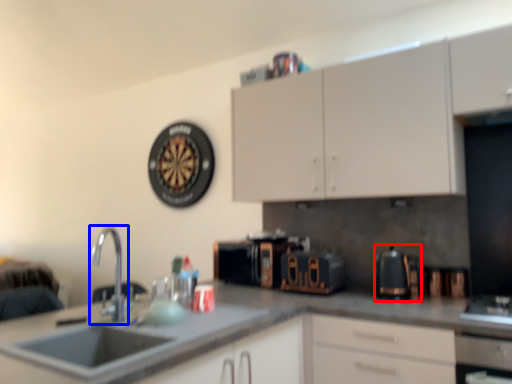
Question: Which object appears farthest to the camera in this image, coffeepot (highlighted by a red box) or tap (highlighted by a blue box)?

Choices:
 (A) coffeepot
 (B) tap

Answer: (A)